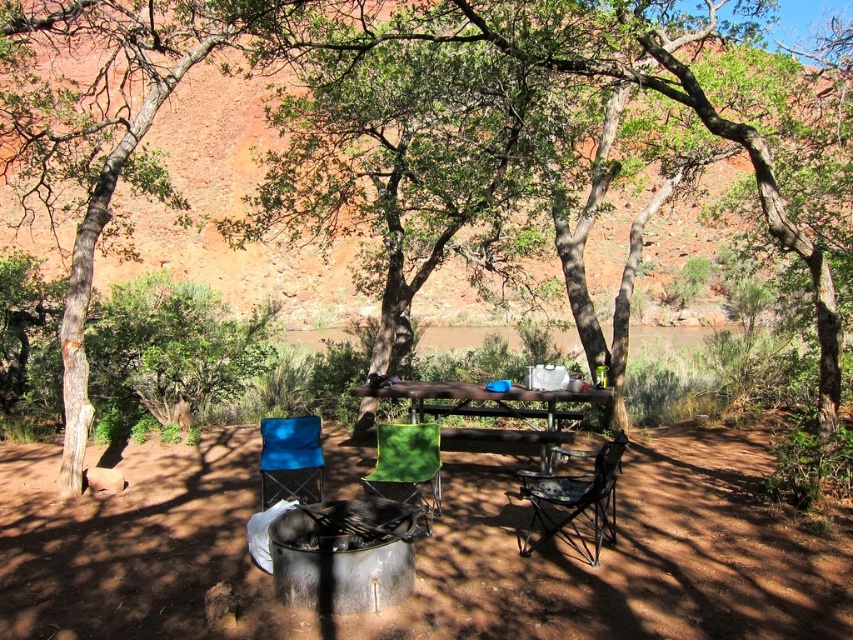
Question: Is brown dirt field at center smaller than camouflage fabric chair at lower right?

Choices:
 (A) no
 (B) yes

Answer: (A)

Question: Which is farther from the camouflage fabric chair at lower right?

Choices:
 (A) blue fabric chair at lower left
 (B) wooden picnic table at center

Answer: (A)

Question: Which point is farther to the camera?

Choices:
 (A) camouflage fabric chair at lower right
 (B) green fabric chair at center
 (C) blue fabric chair at lower left

Answer: (C)

Question: Does brown dirt field at center have a greater width compared to green fabric chair at center?

Choices:
 (A) yes
 (B) no

Answer: (A)

Question: Which of the following is the closest to the observer?

Choices:
 (A) (281, 428)
 (B) (740, 488)
 (C) (392, 490)
 (D) (412, 408)

Answer: (A)

Question: Does camouflage fabric chair at lower right appear on the right side of green fabric chair at center?

Choices:
 (A) no
 (B) yes

Answer: (B)